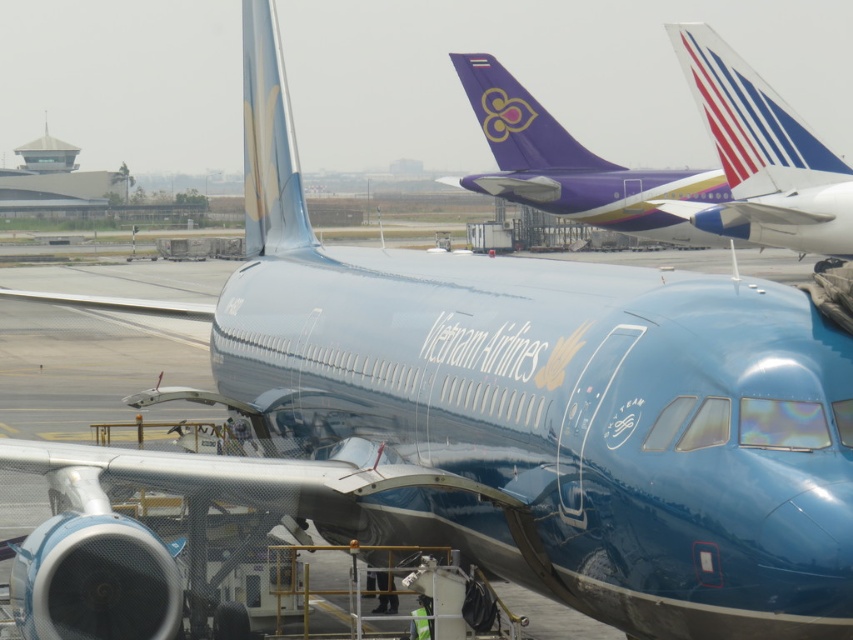
Question: Which object appears farthest from the camera in this image?

Choices:
 (A) blue glossy tail at upper right
 (B) glossy blue tail at center
 (C) metallic purple airplane at upper center

Answer: (C)

Question: Which of the following is the closest to the observer?

Choices:
 (A) blue glossy tail at upper right
 (B) metallic purple airplane at upper center
 (C) glossy blue tail at center

Answer: (C)

Question: Can you confirm if blue glossy tail at upper right is bigger than glossy blue tail at center?

Choices:
 (A) yes
 (B) no

Answer: (B)

Question: From the image, what is the correct spatial relationship of metallic purple airplane at upper center in relation to glossy blue tail at center?

Choices:
 (A) above
 (B) below

Answer: (B)

Question: Is the position of blue glossy tail at upper right less distant than that of glossy blue tail at center?

Choices:
 (A) yes
 (B) no

Answer: (B)

Question: Which object is closer to the camera taking this photo?

Choices:
 (A) blue glossy tail at upper right
 (B) glossy blue tail at center
 (C) metallic purple airplane at upper center

Answer: (B)